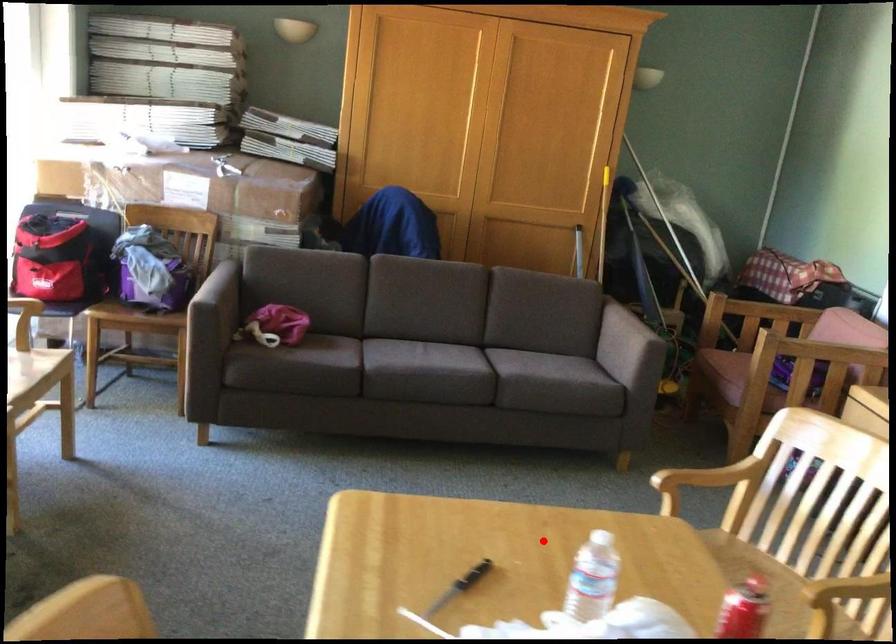
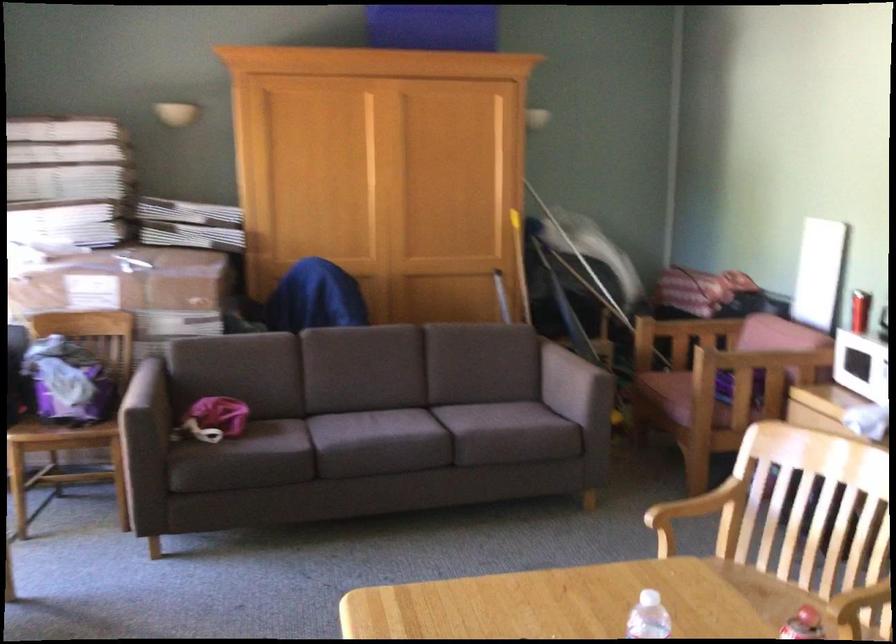
Where in the second image is the point corresponding to the highlighted location from the first image?

(555, 603)